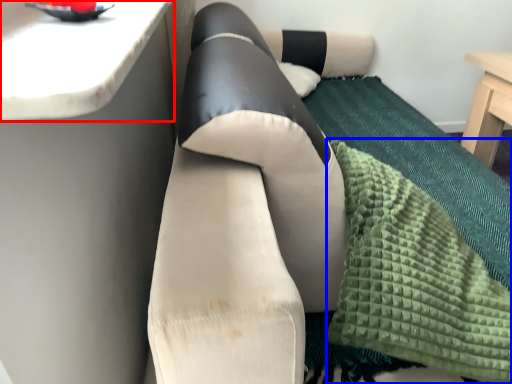
Question: Among these objects, which one is nearest to the camera, counter top (highlighted by a red box) or blanket (highlighted by a blue box)?

Choices:
 (A) counter top
 (B) blanket

Answer: (A)